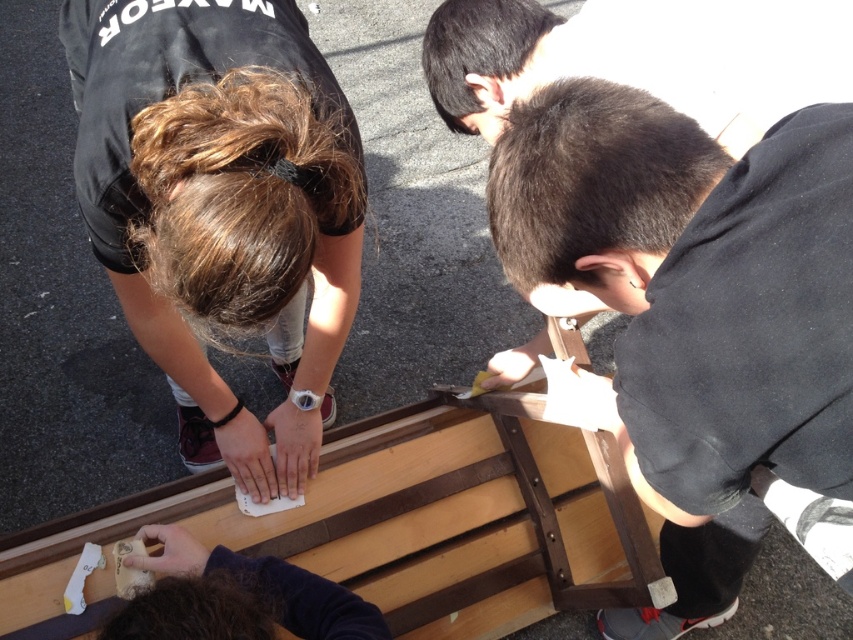
Based on the scene description, what is located at the coordinates point (221, 209)?

The coordinates point (221, 209) is occupied by the matte black shirt at upper left.

You are standing 5 feet away from the wooden plank at center. Can you reach it without moving your feet?

The wooden plank at center is 4.26 feet away from the camera, so if you are standing 5 feet away from it, you would need to move closer by approximately 0.74 feet to reach it without stretching too much.

From the picture: You are standing in a park and see two objects made of wood at the center of the image. One is labeled as the wooden plank at center and the other as the black matte wood at center. Which one is positioned lower in the image?

The wooden plank at center is located below black matte wood at center, so the wooden plank at center is positioned lower in the image.